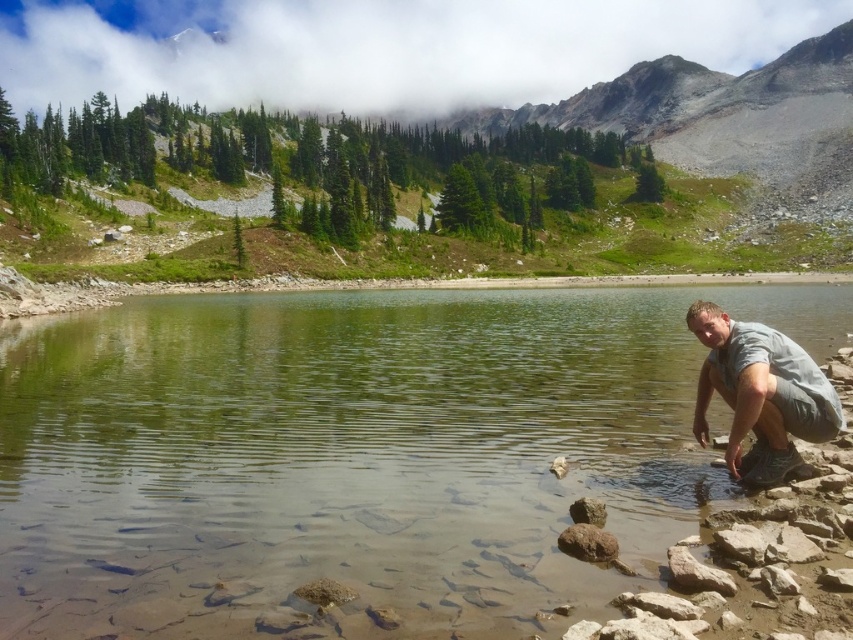
Question: Is clear water at lower right closer to the viewer compared to gray fabric pants at lower right?

Choices:
 (A) no
 (B) yes

Answer: (B)

Question: Does clear water at lower right appear on the left side of gray fabric pants at lower right?

Choices:
 (A) no
 (B) yes

Answer: (B)

Question: Which point is farther from the camera taking this photo?

Choices:
 (A) (282, 596)
 (B) (824, 417)

Answer: (B)

Question: Is clear water at lower right above gray fabric pants at lower right?

Choices:
 (A) yes
 (B) no

Answer: (B)

Question: Which point is closer to the camera?

Choices:
 (A) gray fabric pants at lower right
 (B) clear water at lower right

Answer: (B)